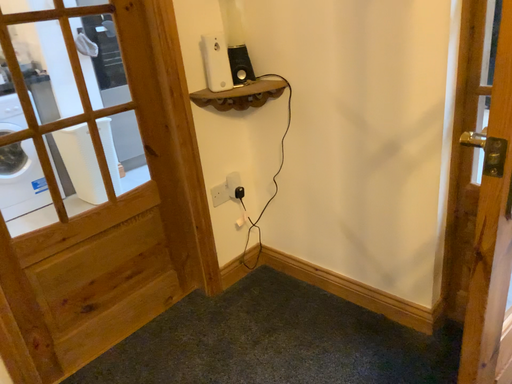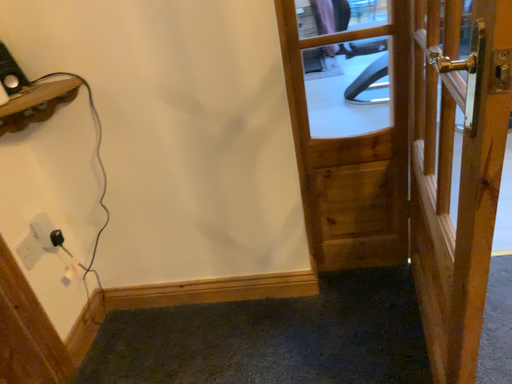
Question: How did the camera likely rotate when shooting the video?

Choices:
 (A) rotated upward
 (B) rotated downward

Answer: (A)